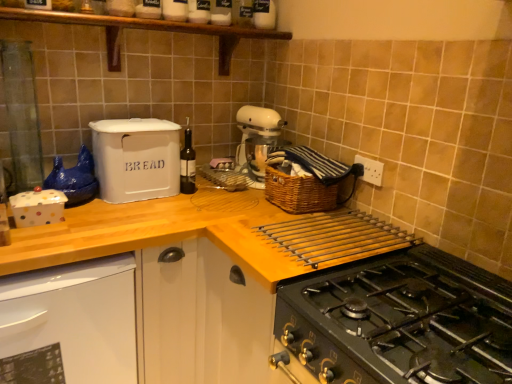
What are the coordinates of `vacant area that is in front of white matte bread bin at upper left` in the screenshot? It's located at (123, 214).